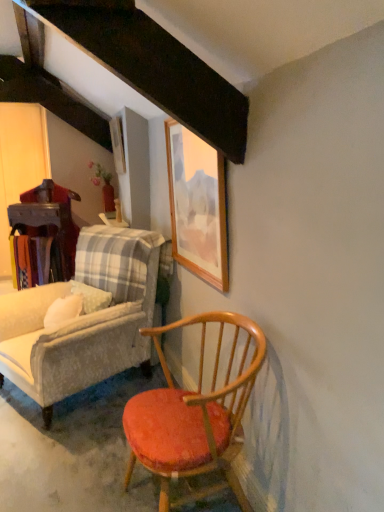
Question: Could you tell me if wooden table at left is facing wooden chair with orange cushion at lower right, the second chair positioned from the left?

Choices:
 (A) no
 (B) yes

Answer: (A)

Question: Considering the relative sizes of wooden table at left and wooden chair with orange cushion at lower right, arranged as the first chair when viewed from the right, in the image provided, is wooden table at left shorter than wooden chair with orange cushion at lower right, arranged as the first chair when viewed from the right,?

Choices:
 (A) yes
 (B) no

Answer: (B)

Question: Is wooden table at left not near wooden chair with orange cushion at lower right, arranged as the first chair when viewed from the front?

Choices:
 (A) yes
 (B) no

Answer: (A)

Question: From a real-world perspective, is wooden table at left over wooden chair with orange cushion at lower right, the second chair from the back?

Choices:
 (A) no
 (B) yes

Answer: (B)

Question: From the image's perspective, is wooden table at left above wooden chair with orange cushion at lower right, arranged as the first chair when viewed from the right?

Choices:
 (A) yes
 (B) no

Answer: (A)

Question: Is wooden picture frame at upper center, which ranks as the first picture frame in back-to-front order, spatially inside wooden chair with orange cushion at lower right, the second chair from the back, or outside of it?

Choices:
 (A) inside
 (B) outside

Answer: (B)

Question: From the image's perspective, is wooden picture frame at upper center, positioned as the 2th picture frame in bottom-to-top order, positioned above or below wooden chair with orange cushion at lower right, the second chair from the back?

Choices:
 (A) below
 (B) above

Answer: (B)

Question: In the image, is wooden picture frame at upper center, which appears as the 2th picture frame when viewed from the right, positioned in front of or behind wooden chair with orange cushion at lower right, the second chair positioned from the left?

Choices:
 (A) front
 (B) behind

Answer: (B)

Question: Would you say wooden picture frame at upper center, marked as the first picture frame in a left-to-right arrangement, is to the left or to the right of wooden chair with orange cushion at lower right, arranged as the first chair when viewed from the right, in the picture?

Choices:
 (A) right
 (B) left

Answer: (B)

Question: From the image's perspective, is wooden picture frame at upper center, which appears as the 2th picture frame when viewed from the right, located above or below wooden table at left?

Choices:
 (A) below
 (B) above

Answer: (B)

Question: Is wooden picture frame at upper center, acting as the 2th picture frame starting from the front, bigger or smaller than wooden table at left?

Choices:
 (A) small
 (B) big

Answer: (A)

Question: From a real-world perspective, is wooden picture frame at upper center, marked as the first picture frame in a left-to-right arrangement, positioned above or below wooden table at left?

Choices:
 (A) above
 (B) below

Answer: (A)

Question: Considering the positions of wooden picture frame at upper center, which appears as the 2th picture frame when viewed from the right, and wooden table at left in the image, is wooden picture frame at upper center, which appears as the 2th picture frame when viewed from the right, taller or shorter than wooden table at left?

Choices:
 (A) tall
 (B) short

Answer: (B)

Question: Is wooden chair with orange cushion at lower right, the second chair from the back, taller or shorter than wooden table at left?

Choices:
 (A) short
 (B) tall

Answer: (A)

Question: Considering the positions of wooden chair with orange cushion at lower right, the second chair positioned from the left, and wooden table at left in the image, is wooden chair with orange cushion at lower right, the second chair positioned from the left, wider or thinner than wooden table at left?

Choices:
 (A) wide
 (B) thin

Answer: (A)